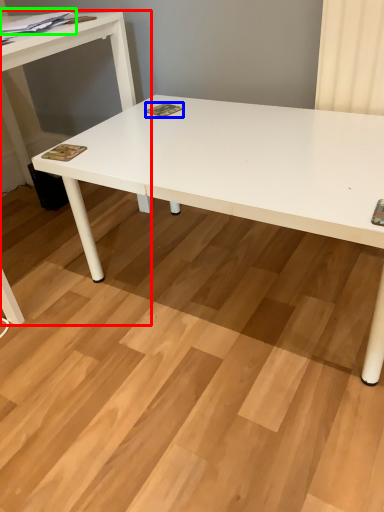
Question: Which is farther away from table (highlighted by a red box)? magazine (highlighted by a blue box) or magazine (highlighted by a green box)?

Choices:
 (A) magazine
 (B) magazine

Answer: (A)